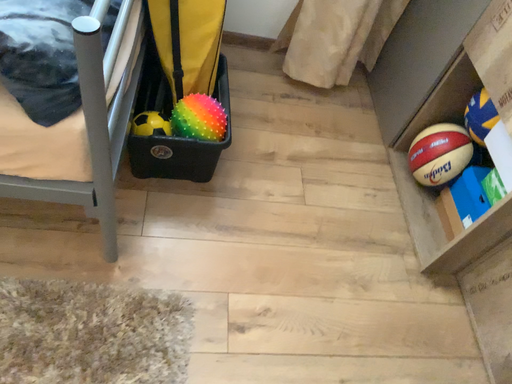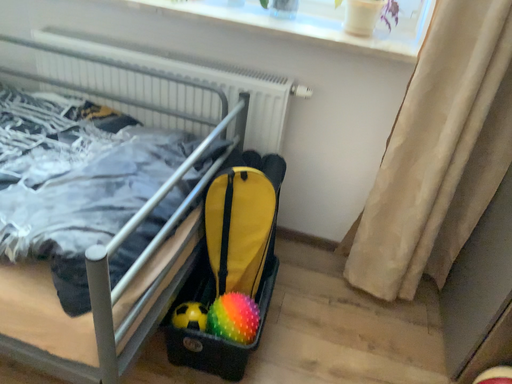
Question: How did the camera likely rotate when shooting the video?

Choices:
 (A) rotated downward
 (B) rotated upward

Answer: (B)